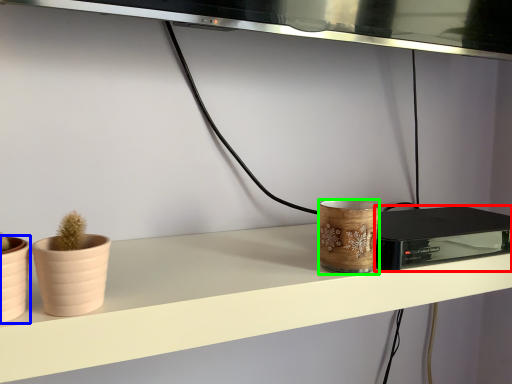
Question: Which object is positioned closest to appliance (highlighted by a red box)? Select from flowerpot (highlighted by a blue box) and pottery (highlighted by a green box).

Choices:
 (A) flowerpot
 (B) pottery

Answer: (B)